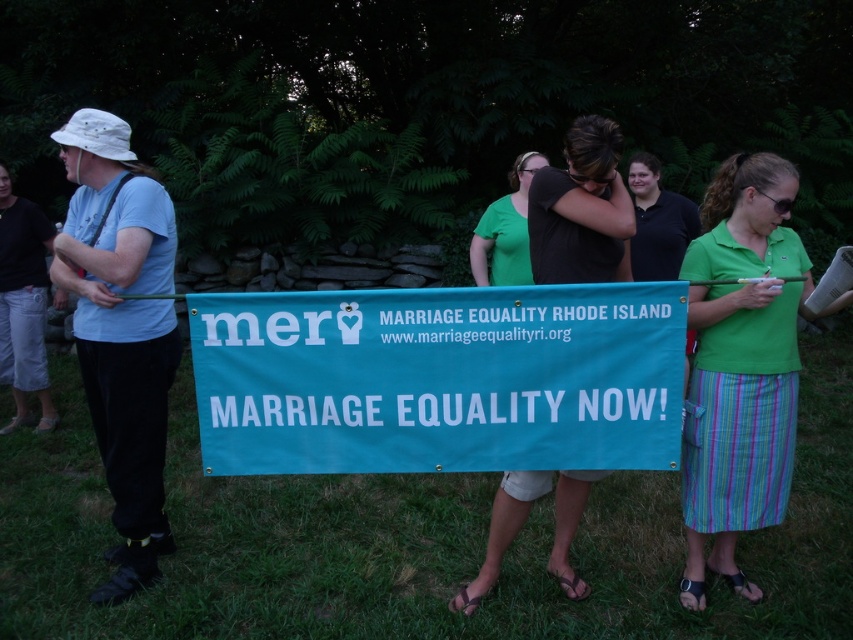
Is teal fabric banner at center wider than green cotton shirt at center?

Correct, the width of teal fabric banner at center exceeds that of green cotton shirt at center.

Is teal fabric banner at center to the left of green cotton shirt at center from the viewer's perspective?

Yes, teal fabric banner at center is to the left of green cotton shirt at center.

The height and width of the screenshot is (640, 853). Identify the location of teal fabric banner at center. click(x=439, y=378).

Between teal fabric banner at center and dark brown hair at center, which one appears on the right side from the viewer's perspective?

dark brown hair at center

Looking at this image, does teal fabric banner at center have a lesser width compared to dark brown hair at center?

Incorrect, teal fabric banner at center's width is not less than dark brown hair at center's.

The width and height of the screenshot is (853, 640). Find the location of `teal fabric banner at center`. teal fabric banner at center is located at coordinates (439, 378).

Does point (747, 509) come in front of point (550, 228)?

No, (747, 509) is behind (550, 228).

Which is behind, point (680, 589) or point (576, 481)?

Positioned behind is point (680, 589).

Where is `green cotton shirt at center`? The image size is (853, 640). green cotton shirt at center is located at coordinates (740, 365).